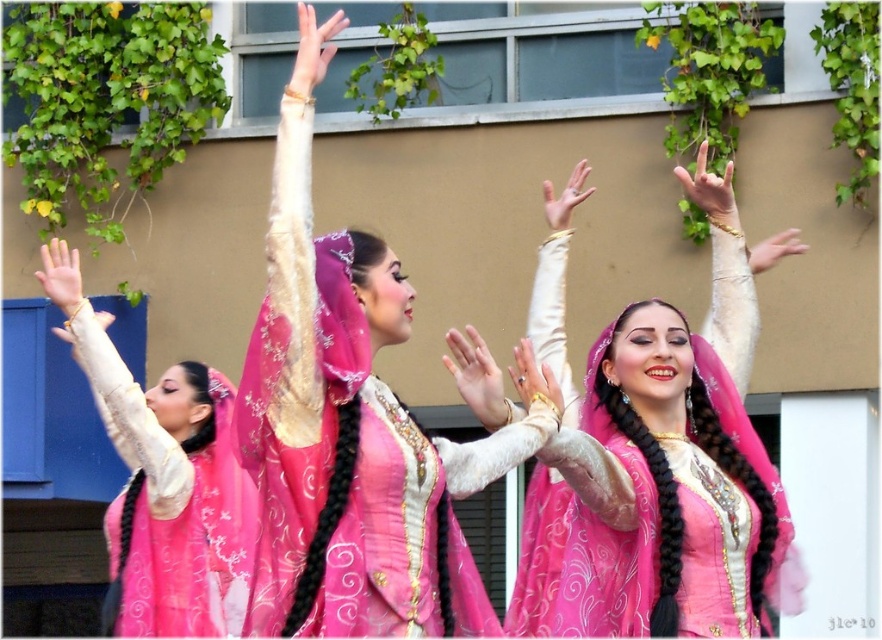
Where is `pink satin dress at center`? The height and width of the screenshot is (640, 882). pink satin dress at center is located at coordinates (652, 472).

Between pink satin dress at center and matte gold bracelet at center, which one appears on the right side from the viewer's perspective?

pink satin dress at center

The height and width of the screenshot is (640, 882). I want to click on pink satin dress at center, so click(652, 472).

I want to click on pink satin dress at center, so click(x=652, y=472).

Which is in front, point (453, 340) or point (783, 236)?

Point (453, 340) is in front.

Between point (475, 397) and point (783, 250), which one is positioned behind?

The point (783, 250) is behind.

Where is `matte gold bracelet at center`? The width and height of the screenshot is (882, 640). matte gold bracelet at center is located at coordinates (476, 378).

Which of these two, smooth cream hand at upper center or matte pink fabric hand at upper center, stands taller?

Standing taller between the two is smooth cream hand at upper center.

Can you confirm if smooth cream hand at upper center is positioned below matte pink fabric hand at upper center?

No, smooth cream hand at upper center is not below matte pink fabric hand at upper center.

Locate an element on the screen. smooth cream hand at upper center is located at coordinates (312, 49).

The height and width of the screenshot is (640, 882). What are the coordinates of `smooth cream hand at upper center` in the screenshot? It's located at (312, 49).